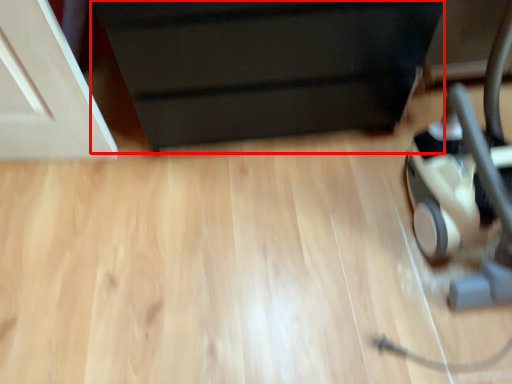
Question: Where is furniture (annotated by the red box) located in relation to baby carriage in the image?

Choices:
 (A) left
 (B) right

Answer: (A)